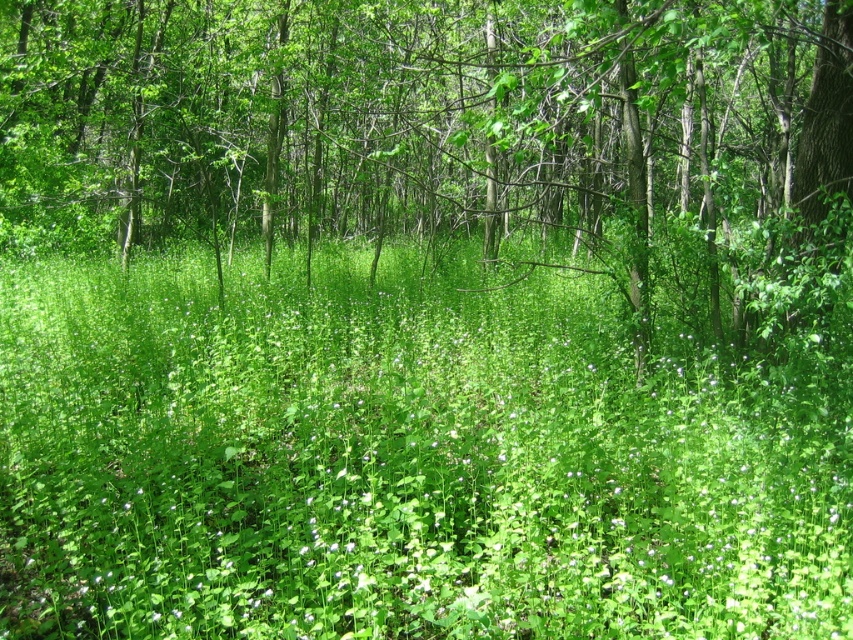
You are a hiker walking through the forest and want to step onto the green leafy grass at center. Are you able to see the green leafy tree at center from your current position?

Yes, because the green leafy grass at center is in front of the green leafy tree at center, you can see the tree behind the grass.

You are a hiker who wants to cross through the forest. You notice the green leafy grass at center and the green leafy tree at center. Which one is taller?

The green leafy tree at center is taller than the green leafy grass at center.

You are standing in the forest and see a point marked at coordinates (404, 460). Based on the scene description, what is located at that point?

The point at coordinates (404, 460) corresponds to green leafy grass at center.